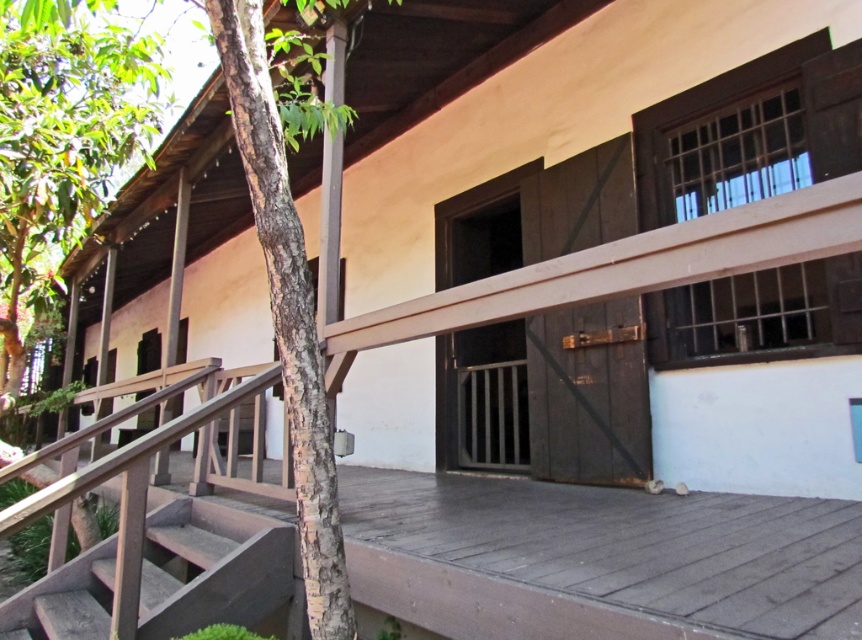
Who is lower down, brown textured tree at left or brown rough bark tree at center?

Positioned lower is brown rough bark tree at center.

Does brown textured tree at left have a smaller size compared to brown rough bark tree at center?

No, brown textured tree at left is not smaller than brown rough bark tree at center.

Does point (292, 419) come closer to viewer compared to point (307, 432)?

No, it is behind (307, 432).

Find the location of `brown textured tree at left`. brown textured tree at left is located at coordinates (288, 273).

Is point (292, 54) farther from viewer compared to point (279, 579)?

Yes, it is behind point (279, 579).

Can you confirm if brown textured tree at left is positioned to the right of wooden stairs at lower left?

Yes, brown textured tree at left is to the right of wooden stairs at lower left.

Is point (292, 77) behind point (53, 630)?

No, it is not.

Locate an element on the screen. brown textured tree at left is located at coordinates (288, 273).

Which is in front, point (123, 150) or point (330, 484)?

Positioned in front is point (330, 484).

Can you confirm if green leafy tree at left is thinner than brown rough bark tree at center?

Correct, green leafy tree at left's width is less than brown rough bark tree at center's.

Is point (132, 65) positioned behind point (248, 3)?

That is True.

Find the location of a particular element. green leafy tree at left is located at coordinates pyautogui.click(x=61, y=144).